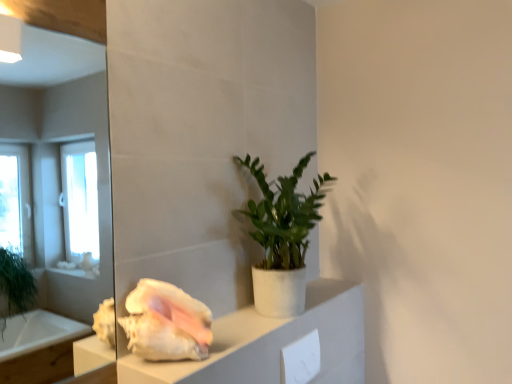
Where is `vacant space to the right of white glossy seashell at lower left`? The width and height of the screenshot is (512, 384). vacant space to the right of white glossy seashell at lower left is located at coordinates (226, 347).